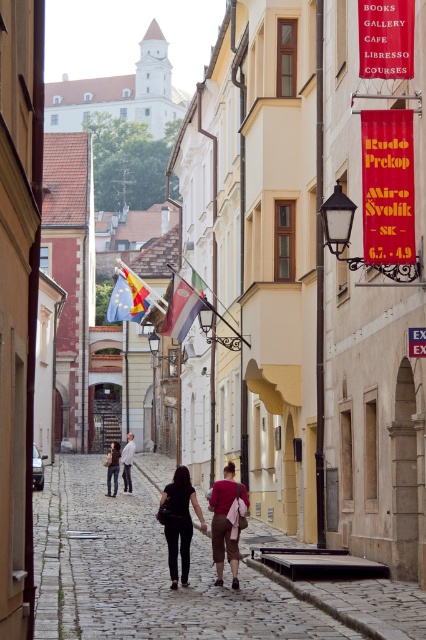
You are standing on the cobblestone street and see both the polished wood flag at center and the dark brown leather jacket at center. Which object is nearer to you?

The polished wood flag at center is closer to the viewer than the dark brown leather jacket at center.

You are a tourist standing on the cobblestone street in the historic town. You see the dark brown leather pants at center. Where exactly are the dark brown leather pants located in the scene?

The dark brown leather pants at center are located at the coordinates point [180,522] in the scene.

You are a tourist in a historic town and want to take a photo of the cobblestone alley at center and the polished wood flag at center. Since you want both objects to be clearly visible in the photo, which object should you focus on to ensure it appears larger in the frame?

The cobblestone alley at center is larger in size than the polished wood flag at center, so you should focus on the cobblestone alley at center to ensure it appears larger in the frame.